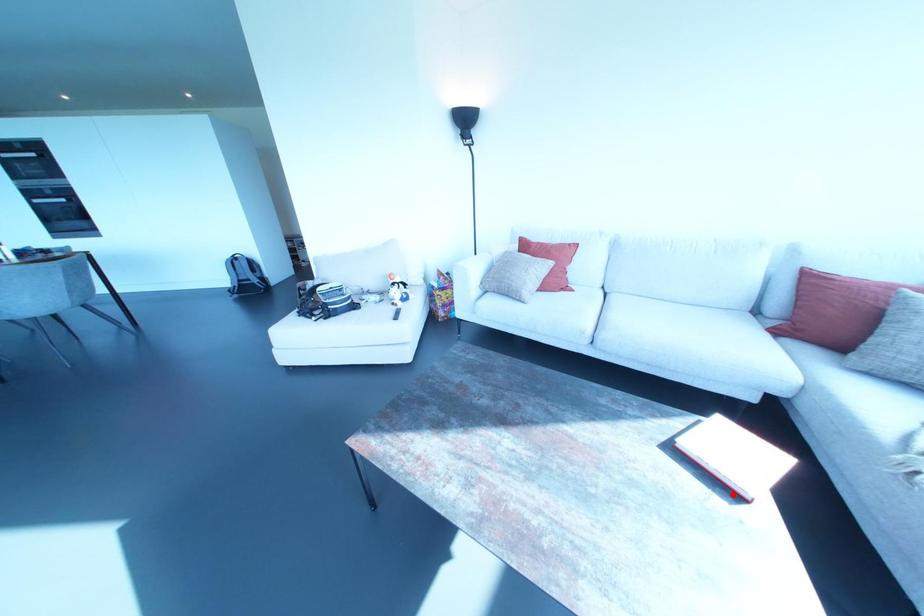
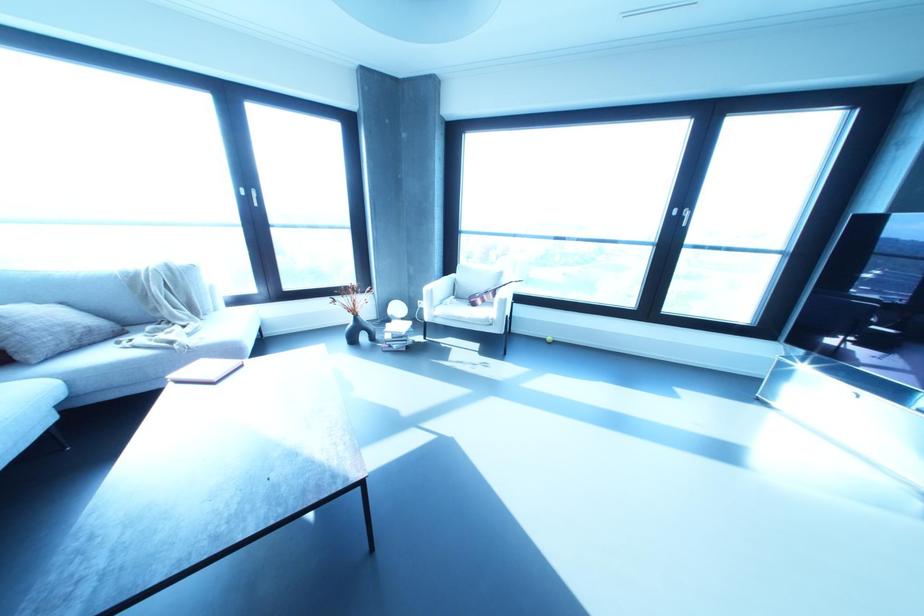
Question: I am providing you with two images of the same scene from different viewpoints. Image1 has a red point marked. In image2, the corresponding 3D location appears at what relative position? Reply with the corresponding letter.

Choices:
 (A) Closer
 (B) Farther

Answer: (A)